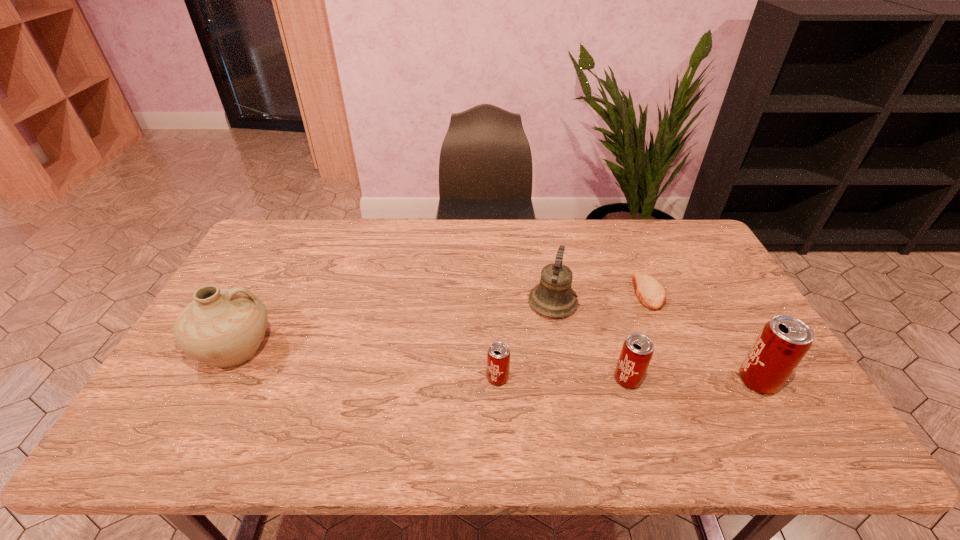
Identify the location of unoccupied position between the tallest beer can and the second tallest beer can. The width and height of the screenshot is (960, 540). (693, 380).

This screenshot has width=960, height=540. What are the coordinates of `blank region between the second shortest object and the shortest object` in the screenshot? It's located at (573, 335).

Identify which object is the fourth nearest to the rightmost object. Please provide its 2D coordinates. Your answer should be formatted as a tuple, i.e. [(x, y)], where the tuple contains the x and y coordinates of a point satisfying the conditions above.

[(498, 356)]

The height and width of the screenshot is (540, 960). I want to click on object that stands as the fifth closest to the leftmost object, so click(x=783, y=342).

Choose which beer can is the second nearest neighbor to the fourth object from right to left. Please provide its 2D coordinates. Your answer should be formatted as a tuple, i.e. [(x, y)], where the tuple contains the x and y coordinates of a point satisfying the conditions above.

[(498, 356)]

Point out which beer can is positioned as the second nearest to the bell. Please provide its 2D coordinates. Your answer should be formatted as a tuple, i.e. [(x, y)], where the tuple contains the x and y coordinates of a point satisfying the conditions above.

[(498, 356)]

Find the location of `vacant region that satisfies the following two spatial constraints: 1. on the back side of the bell; 2. on the right side of the pottery`. vacant region that satisfies the following two spatial constraints: 1. on the back side of the bell; 2. on the right side of the pottery is located at coordinates (259, 303).

Find the location of `vacant space that satisfies the following two spatial constraints: 1. on the front side of the pottery; 2. on the right side of the second tallest beer can`. vacant space that satisfies the following two spatial constraints: 1. on the front side of the pottery; 2. on the right side of the second tallest beer can is located at coordinates (219, 379).